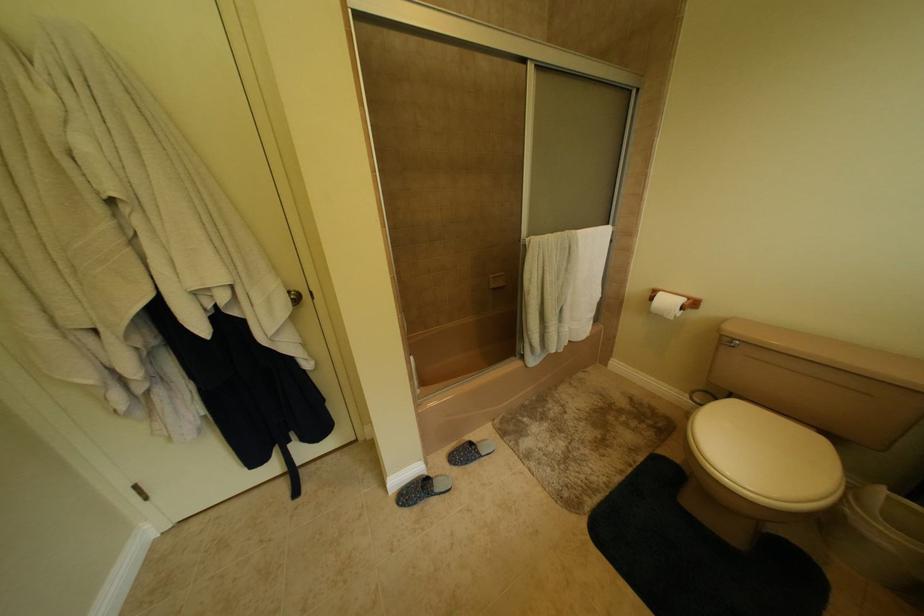
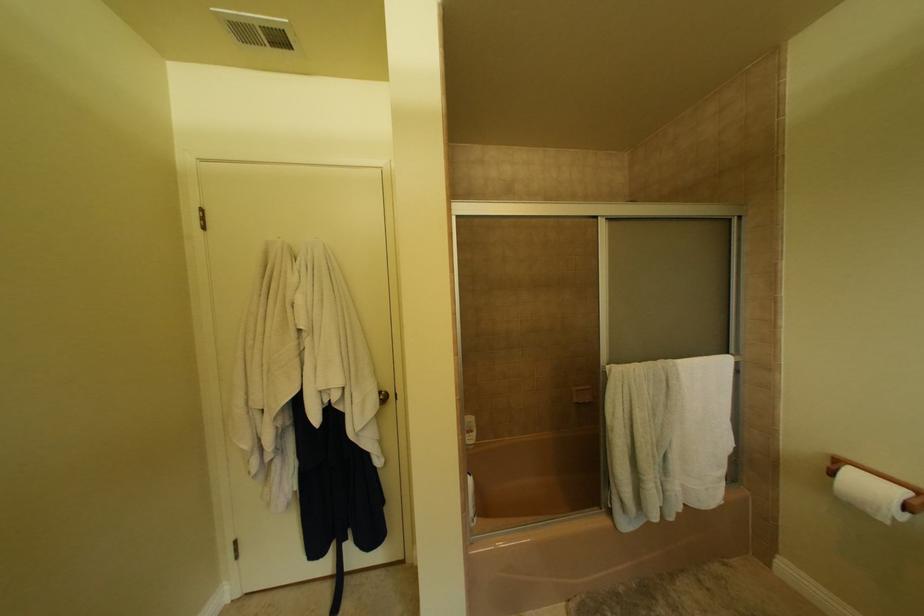
First-person continuous shooting, in which direction is the camera rotating?

The rotation direction of the camera is left-up.